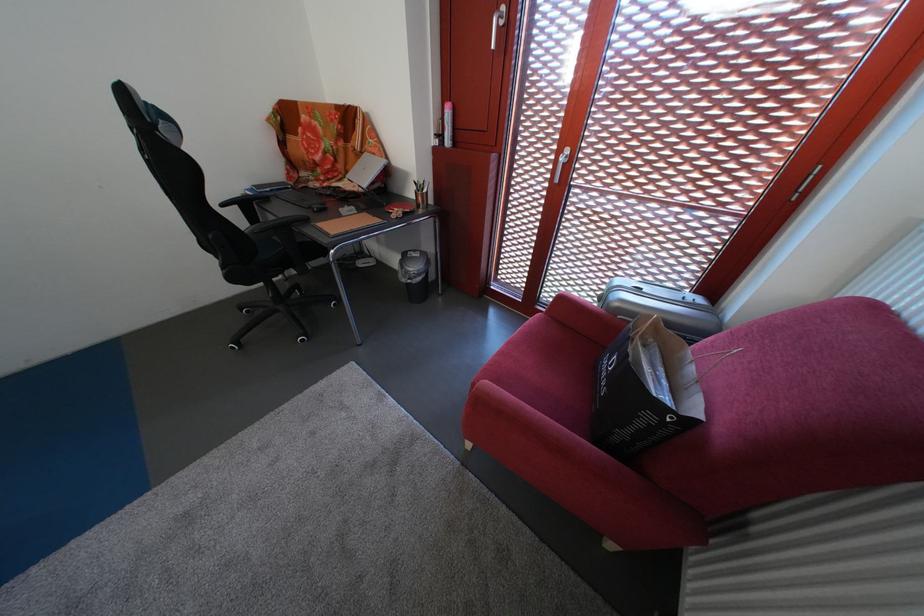
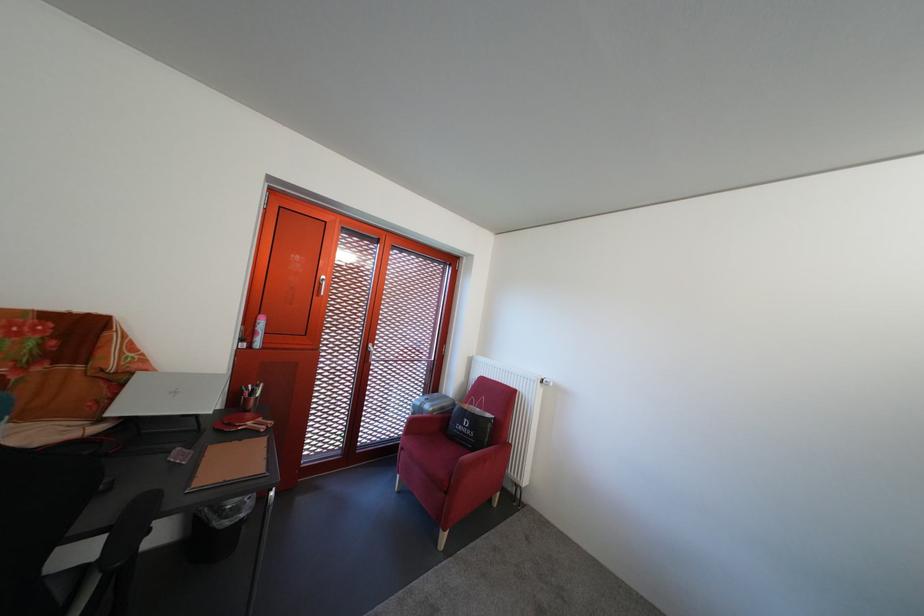
Locate, in the second image, the point that corresponds to point 415,286 in the first image.

(237, 530)